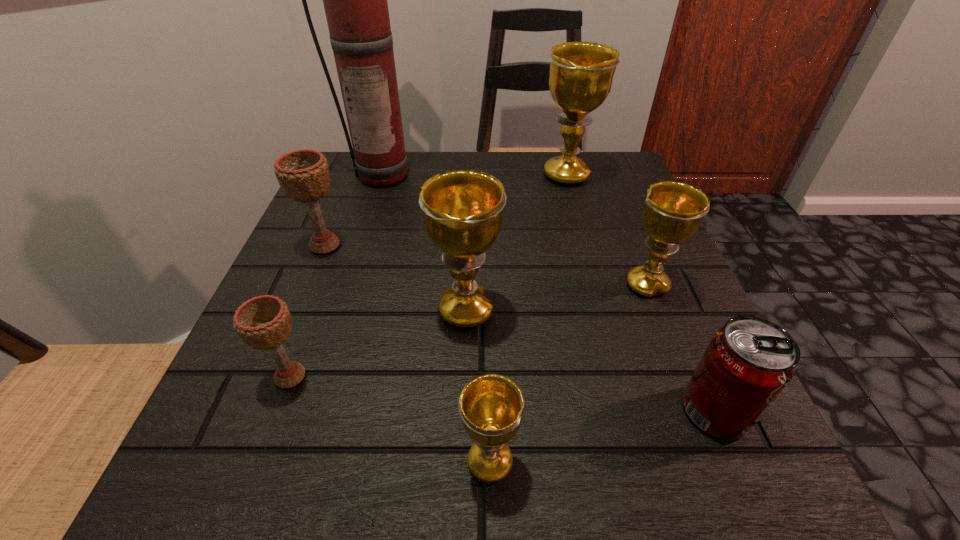
The image size is (960, 540). In order to click on object present at the near right corner in this screenshot , I will do `click(748, 363)`.

At what (x,y) coordinates should I click in order to perform the action: click on vacant space at the far edge of the desktop. Please return your answer as a coordinate pair (x, y). This screenshot has width=960, height=540. Looking at the image, I should click on (417, 157).

Identify the location of vacant space at the near edge of the desktop. This screenshot has height=540, width=960. (480, 495).

The image size is (960, 540). In the image, there is a desktop. In order to click on vacant region at the left edge in this screenshot , I will do `click(348, 325)`.

Identify the location of vacant region at the right edge of the desktop. This screenshot has height=540, width=960. (573, 210).

Where is `vacant space at the far left corner of the desktop`? This screenshot has width=960, height=540. vacant space at the far left corner of the desktop is located at coordinates (324, 205).

The height and width of the screenshot is (540, 960). I want to click on vacant space at the near left corner of the desktop, so click(236, 479).

Where is `free region at the far right corner`? free region at the far right corner is located at coordinates [x=600, y=183].

This screenshot has height=540, width=960. I want to click on vacant region between the third tallest object and the seventh shortest object, so click(516, 242).

I want to click on empty space between the fire extinguisher and the pop soda, so click(x=550, y=292).